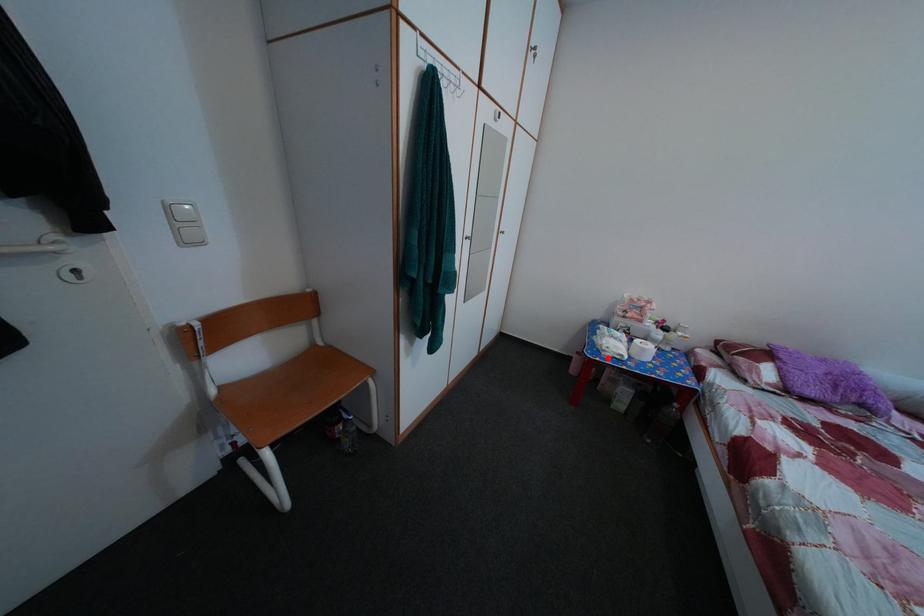
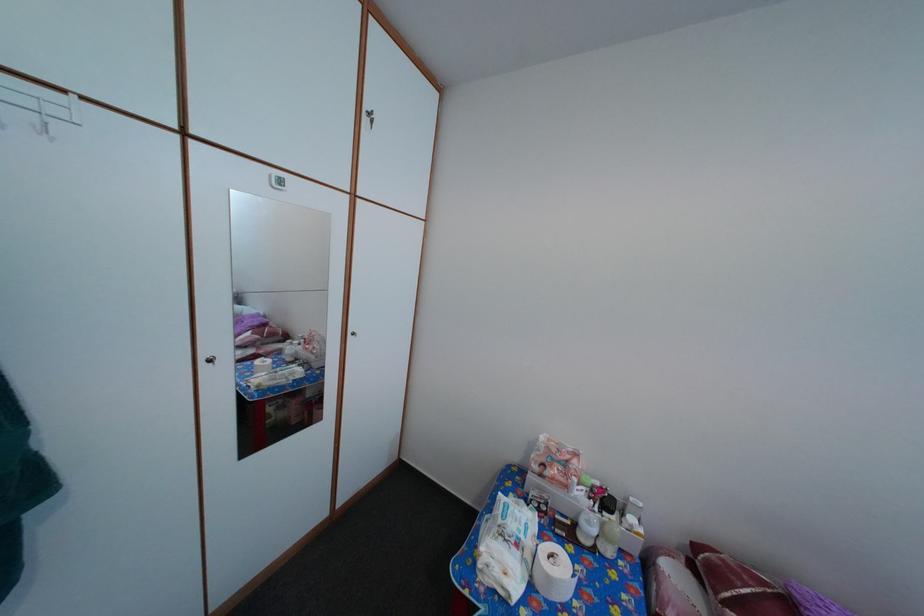
Question: I am providing you with two images of the same scene from different viewpoints. A red point is shown in image1. For the corresponding object point in image2, is it positioned nearer or farther from the camera?

Choices:
 (A) Nearer
 (B) Farther

Answer: (B)